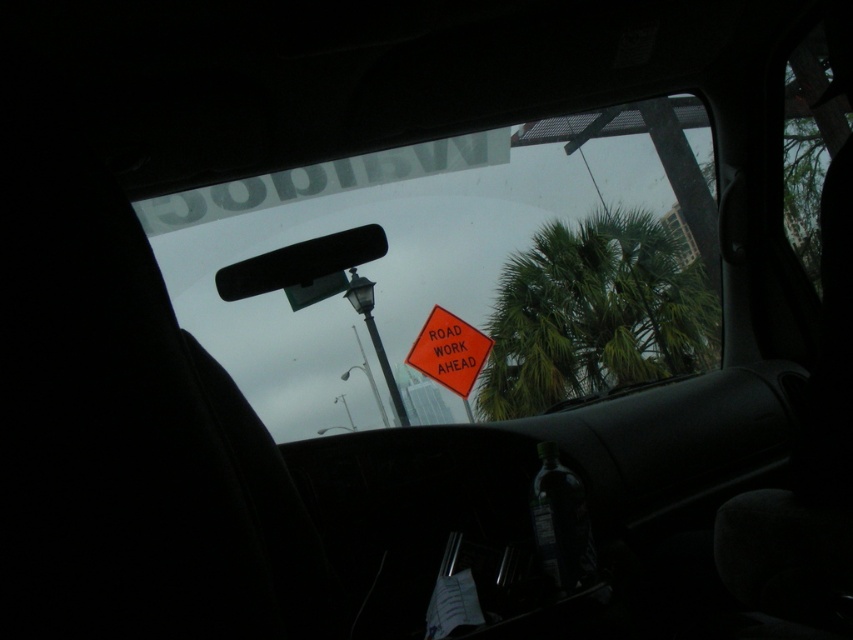
Can you confirm if green leafy palm tree at center is smaller than orange reflective road sign at center?

Incorrect, green leafy palm tree at center is not smaller in size than orange reflective road sign at center.

Is point (700, 273) in front of point (468, 340)?

No, it is behind (468, 340).

Where is `green leafy palm tree at center`? green leafy palm tree at center is located at coordinates (595, 314).

Which is behind, point (550, 129) or point (653, 317)?

Point (653, 317)

Where is `orange diamond-shaped sign at center`? The width and height of the screenshot is (853, 640). orange diamond-shaped sign at center is located at coordinates (462, 268).

Who is shorter, orange diamond-shaped sign at center or orange reflective road sign at center?

Standing shorter between the two is orange reflective road sign at center.

Does point (637, 243) come in front of point (444, 314)?

No, it is not.

Where is `orange diamond-shaped sign at center`? Image resolution: width=853 pixels, height=640 pixels. orange diamond-shaped sign at center is located at coordinates (462, 268).